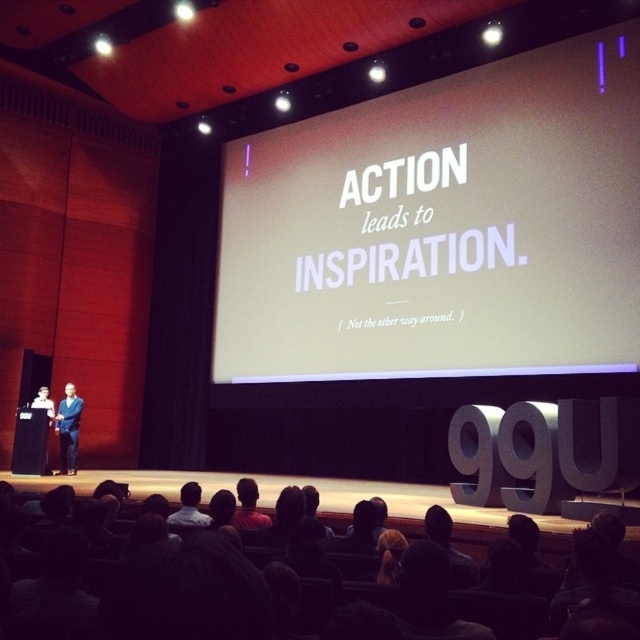
Is white matte screen at center to the left of dark hair at center from the viewer's perspective?

No, white matte screen at center is not to the left of dark hair at center.

From the picture: Does white matte screen at center appear on the right side of dark hair at center?

Indeed, white matte screen at center is positioned on the right side of dark hair at center.

This screenshot has height=640, width=640. I want to click on white matte screen at center, so click(x=442, y=227).

Identify the location of white matte screen at center. (442, 227).

How distant is dark hair at center from blue denim jeans at center?

A distance of 8.84 feet exists between dark hair at center and blue denim jeans at center.

Can you confirm if dark hair at center is positioned to the left of blue denim jeans at center?

Incorrect, dark hair at center is not on the left side of blue denim jeans at center.

Image resolution: width=640 pixels, height=640 pixels. What do you see at coordinates (397, 508) in the screenshot? I see `dark hair at center` at bounding box center [397, 508].

At what (x,y) coordinates should I click in order to perform the action: click on dark hair at center. Please return your answer as a coordinate pair (x, y). The image size is (640, 640). Looking at the image, I should click on (397, 508).

Between point (516, 248) and point (58, 412), which one is positioned in front?

Point (516, 248) is in front.

Does white matte screen at center come behind blue denim jeans at center?

No, it is not.

This screenshot has height=640, width=640. What do you see at coordinates (442, 227) in the screenshot?
I see `white matte screen at center` at bounding box center [442, 227].

The height and width of the screenshot is (640, 640). I want to click on white matte screen at center, so click(442, 227).